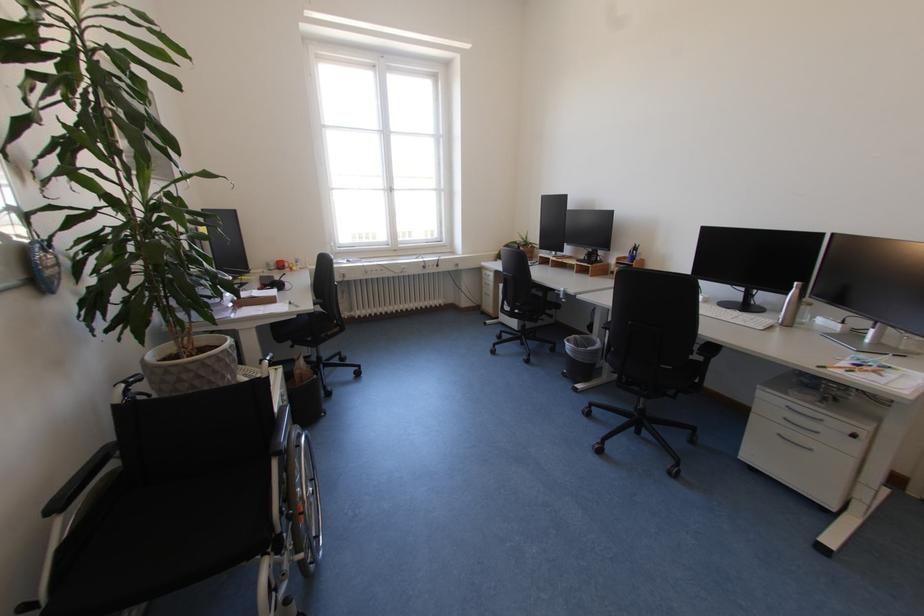
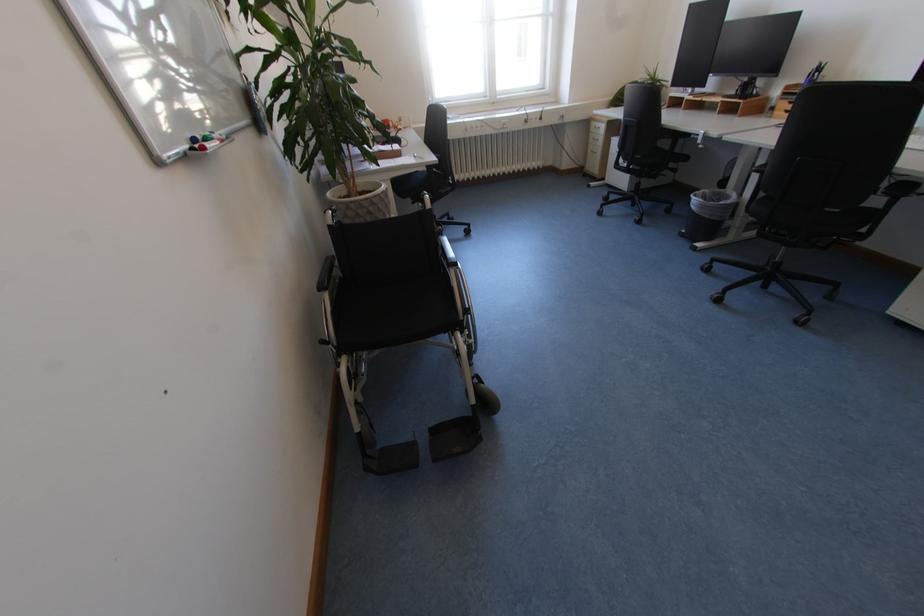
Question: Based on the continuous images, in which direction is the camera rotating? Reply with the corresponding letter.

Choices:
 (A) Left
 (B) Right
 (C) Up
 (D) Down

Answer: (D)